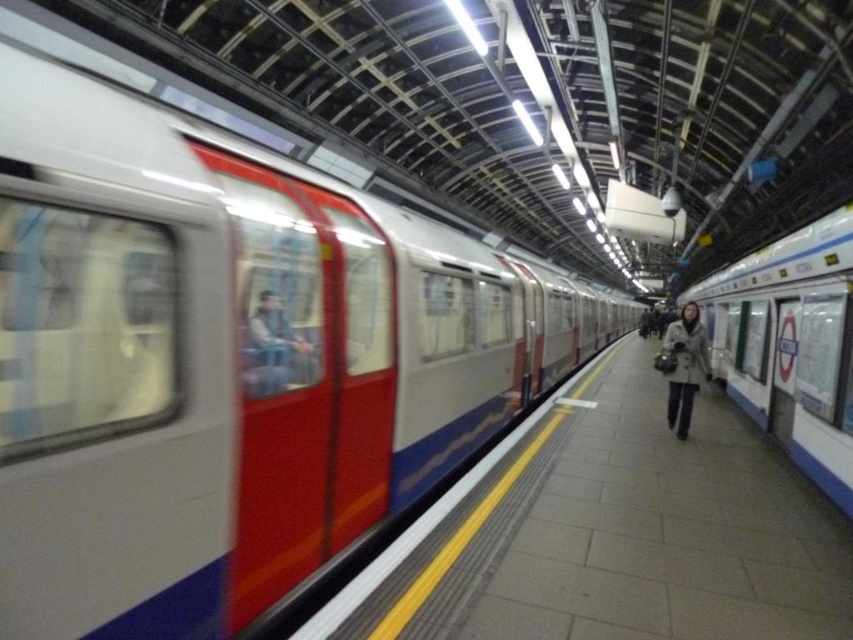
Question: Does smooth concrete platform at center appear on the left side of white glossy train at right?

Choices:
 (A) no
 (B) yes

Answer: (B)

Question: Does smooth concrete platform at center appear over white glossy train at right?

Choices:
 (A) yes
 (B) no

Answer: (B)

Question: Which is farther from the light brown textured coat at center?

Choices:
 (A) white glossy train at right
 (B) smooth concrete platform at center

Answer: (B)

Question: Which object is positioned closest to the smooth concrete platform at center?

Choices:
 (A) white glossy train at right
 (B) light brown textured coat at center

Answer: (B)

Question: Does smooth concrete platform at center have a larger size compared to light brown textured coat at center?

Choices:
 (A) no
 (B) yes

Answer: (A)

Question: Which object is the farthest from the smooth concrete platform at center?

Choices:
 (A) white glossy train at right
 (B) light brown textured coat at center

Answer: (A)